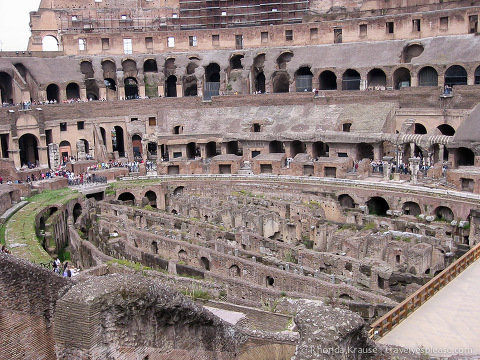
You are a GUI agent. You are given a task and a screenshot of the screen. Output one action in this format:
    pyautogui.click(x=<x>, y=<y>)
    Task: Click on the square windows
    
    Given the screenshot: What is the action you would take?
    pyautogui.click(x=147, y=43), pyautogui.click(x=124, y=46), pyautogui.click(x=191, y=39)